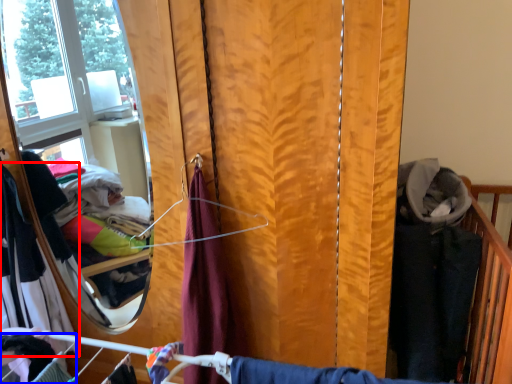
Question: Among these objects, which one is farthest to the camera, clothing (highlighted by a red box) or clothing (highlighted by a blue box)?

Choices:
 (A) clothing
 (B) clothing

Answer: (A)